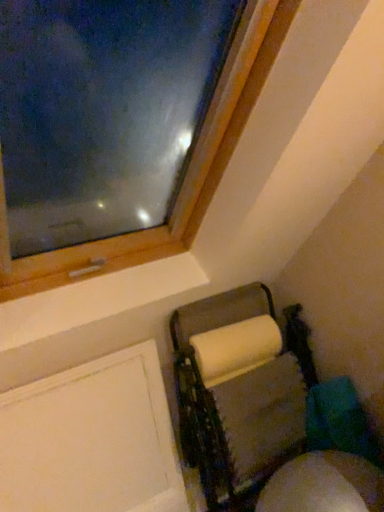
Question: Choose the correct answer: Is white cardboard paper towel holder at lower right inside white matte screen door at lower left or outside it?

Choices:
 (A) outside
 (B) inside

Answer: (A)

Question: From a real-world perspective, relative to white matte screen door at lower left, is white cardboard paper towel holder at lower right vertically above or below?

Choices:
 (A) below
 (B) above

Answer: (A)

Question: Is white cardboard paper towel holder at lower right wider or thinner than white matte screen door at lower left?

Choices:
 (A) thin
 (B) wide

Answer: (B)

Question: Would you say white matte screen door at lower left is to the left or to the right of white cardboard paper towel holder at lower right in the picture?

Choices:
 (A) right
 (B) left

Answer: (B)

Question: From the image's perspective, is white matte screen door at lower left located above or below white cardboard paper towel holder at lower right?

Choices:
 (A) below
 (B) above

Answer: (A)

Question: Looking at their shapes, would you say white matte screen door at lower left is wider or thinner than white cardboard paper towel holder at lower right?

Choices:
 (A) thin
 (B) wide

Answer: (A)

Question: Based on their sizes in the image, would you say white matte screen door at lower left is bigger or smaller than white cardboard paper towel holder at lower right?

Choices:
 (A) big
 (B) small

Answer: (B)